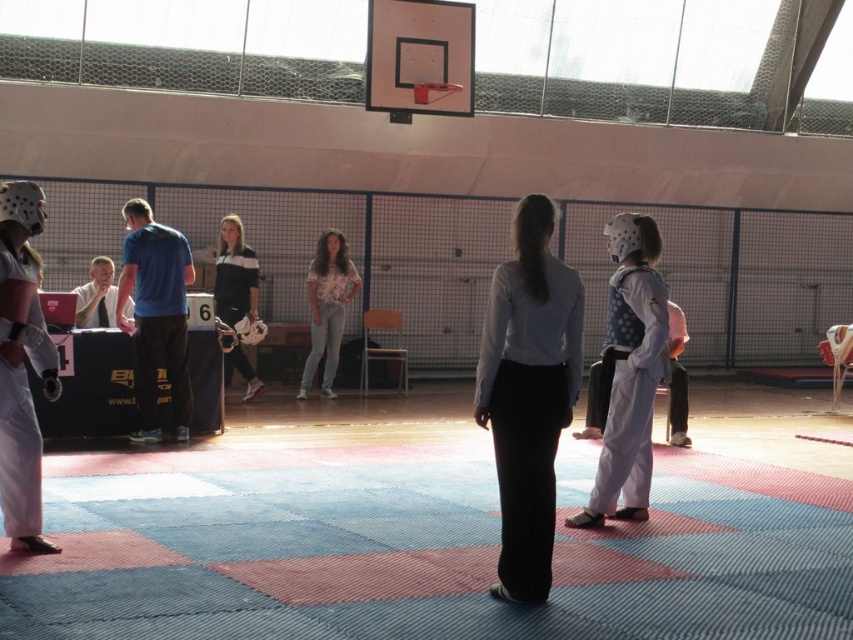
How much distance is there between white matte karate uniform at left and blue fabric pants at left?

3.56 meters

Can you confirm if white matte karate uniform at left is positioned below blue fabric pants at left?

Indeed, white matte karate uniform at left is positioned under blue fabric pants at left.

Identify the location of white matte karate uniform at left. (21, 365).

Locate an element on the screen. white matte karate uniform at left is located at coordinates (21, 365).

From the picture: Can you confirm if white matte karate uniform at center is positioned to the right of floral shirt at center?

Indeed, white matte karate uniform at center is positioned on the right side of floral shirt at center.

Is white matte karate uniform at center above floral shirt at center?

No, white matte karate uniform at center is not above floral shirt at center.

Where is `white matte karate uniform at center`? white matte karate uniform at center is located at coordinates (628, 371).

Image resolution: width=853 pixels, height=640 pixels. I want to click on white matte karate uniform at center, so click(628, 371).

Does white smooth shirt at center lie in front of floral shirt at center?

Yes, it is in front of floral shirt at center.

From the picture: Who is shorter, white smooth shirt at center or floral shirt at center?

With less height is white smooth shirt at center.

What are the coordinates of `white smooth shirt at center` in the screenshot? It's located at (527, 394).